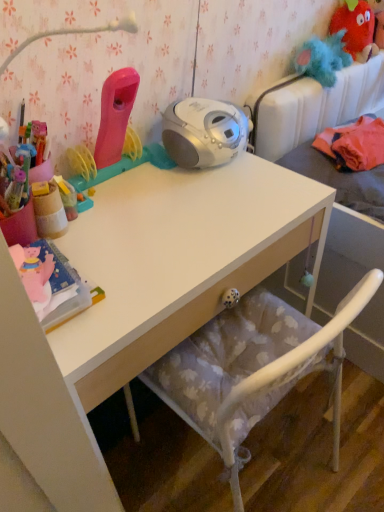
At what (x,y) coordinates should I click in order to perform the action: click on fluffy fabric bed at upper right. Please return your answer as a coordinate pair (x, y). This screenshot has height=512, width=384. Looking at the image, I should click on (318, 106).

Where is `wooden pencil case at left`? The image size is (384, 512). wooden pencil case at left is located at coordinates (50, 214).

Identify the location of fluffy fabric bed at upper right. The width and height of the screenshot is (384, 512). (318, 106).

From the picture: Is wooden pencil case at left turned away from white matte desk at center?

No.

Is wooden pencil case at left in front of or behind white matte desk at center in the image?

In the image, wooden pencil case at left appears behind white matte desk at center.

Does wooden pencil case at left appear on the right side of white matte desk at center?

No.

In the scene shown: Between wooden pencil case at left and white matte desk at center, which one has less height?

With less height is wooden pencil case at left.

Consider the image. Is wooden pencil case at left thinner than fuzzy red monster at upper right?

Correct, the width of wooden pencil case at left is less than that of fuzzy red monster at upper right.

Does wooden pencil case at left appear on the right side of fuzzy red monster at upper right?

In fact, wooden pencil case at left is to the left of fuzzy red monster at upper right.

Which object is closer to the camera taking this photo, wooden pencil case at left or fuzzy red monster at upper right?

wooden pencil case at left is in front.

Considering the relative sizes of wooden pencil case at left and fluffy fabric bed at upper right in the image provided, is wooden pencil case at left wider than fluffy fabric bed at upper right?

In fact, wooden pencil case at left might be narrower than fluffy fabric bed at upper right.

Does wooden pencil case at left turn towards fluffy fabric bed at upper right?

No, wooden pencil case at left is not oriented towards fluffy fabric bed at upper right.

Is wooden pencil case at left smaller than fluffy fabric bed at upper right?

Indeed, wooden pencil case at left has a smaller size compared to fluffy fabric bed at upper right.

From a real-world perspective, relative to fluffy fabric bed at upper right, is wooden pencil case at left vertically above or below?

wooden pencil case at left is situated higher than fluffy fabric bed at upper right in the real world.

From a real-world perspective, is white matte desk at center beneath fuzzy red monster at upper right?

Correct, in the physical world, white matte desk at center is lower than fuzzy red monster at upper right.

Does white matte desk at center have a smaller size compared to fuzzy red monster at upper right?

No.

From the image's perspective, is white matte desk at center over fuzzy red monster at upper right?

Incorrect, from the image's perspective, white matte desk at center is lower than fuzzy red monster at upper right.

Considering the relative sizes of white matte desk at center and fuzzy red monster at upper right in the image provided, is white matte desk at center thinner than fuzzy red monster at upper right?

No.

From a real-world perspective, is fuzzy red monster at upper right positioned over white matte desk at center based on gravity?

Yes, from a real-world perspective, fuzzy red monster at upper right is above white matte desk at center.

Is fuzzy red monster at upper right next to white matte desk at center?

There is a gap between fuzzy red monster at upper right and white matte desk at center.

Is fuzzy red monster at upper right located outside white matte desk at center?

That's correct, fuzzy red monster at upper right is outside of white matte desk at center.

You are a GUI agent. You are given a task and a screenshot of the screen. Output one action in this format:
    pyautogui.click(x=<x>, y=<y>)
    Task: Click on the toy above the white matte desk at center (from the image's perspective)
    
    Given the screenshot: What is the action you would take?
    pyautogui.click(x=356, y=30)

In terms of size, does fuzzy red monster at upper right appear bigger or smaller than wooden pencil case at left?

Clearly, fuzzy red monster at upper right is larger in size than wooden pencil case at left.

Which object is closer to the camera, fuzzy red monster at upper right or wooden pencil case at left?

wooden pencil case at left.

You are a GUI agent. You are given a task and a screenshot of the screen. Output one action in this format:
    pyautogui.click(x=<x>, y=<y>)
    Task: Click on the stationery lying in front of the fuzzy red monster at upper right
    The image size is (384, 512).
    Given the screenshot: What is the action you would take?
    pyautogui.click(x=50, y=214)

Considering the sizes of fuzzy red monster at upper right and wooden pencil case at left in the image, is fuzzy red monster at upper right wider or thinner than wooden pencil case at left?

Clearly, fuzzy red monster at upper right has more width compared to wooden pencil case at left.

Is point (362, 27) positioned in front of point (342, 75)?

That is False.

From the image's perspective, is fuzzy red monster at upper right located beneath fluffy fabric bed at upper right?

Actually, fuzzy red monster at upper right appears above fluffy fabric bed at upper right in the image.

Is fluffy fabric bed at upper right a part of fuzzy red monster at upper right?

No.

Locate an element on the screen. bed located on the right of fuzzy red monster at upper right is located at coordinates (318, 106).

In order to click on desk in front of the wooden pencil case at left in this screenshot , I will do `click(136, 308)`.

Image resolution: width=384 pixels, height=512 pixels. In order to click on toy that is above the wooden pencil case at left (from a real-world perspective) in this screenshot , I will do `click(356, 30)`.

Considering their positions, is fuzzy red monster at upper right positioned further to white matte desk at center than wooden pencil case at left?

fuzzy red monster at upper right.

Estimate the real-world distances between objects in this image. Which object is closer to white matte desk at center, fluffy fabric bed at upper right or fuzzy red monster at upper right?

fluffy fabric bed at upper right is positioned closer to the anchor white matte desk at center.

Estimate the real-world distances between objects in this image. Which object is further from fuzzy red monster at upper right, fluffy fabric bed at upper right or white matte desk at center?

white matte desk at center lies further to fuzzy red monster at upper right than the other object.

Based on the photo, from the image, which object appears to be farther from white matte desk at center, fuzzy red monster at upper right or fluffy fabric bed at upper right?

Based on the image, fuzzy red monster at upper right appears to be further to white matte desk at center.

Estimate the real-world distances between objects in this image. Which object is further from fuzzy red monster at upper right, wooden pencil case at left or white matte desk at center?

wooden pencil case at left.

When comparing their distances from fuzzy red monster at upper right, does fluffy fabric bed at upper right or wooden pencil case at left seem closer?

fluffy fabric bed at upper right lies closer to fuzzy red monster at upper right than the other object.

Based on their spatial positions, is white matte desk at center or fuzzy red monster at upper right further from wooden pencil case at left?

fuzzy red monster at upper right.

Considering their positions, is wooden pencil case at left positioned further to fuzzy red monster at upper right than fluffy fabric bed at upper right?

Among the two, wooden pencil case at left is located further to fuzzy red monster at upper right.

Where is `desk between wooden pencil case at left and fluffy fabric bed at upper right from left to right`? This screenshot has width=384, height=512. desk between wooden pencil case at left and fluffy fabric bed at upper right from left to right is located at coordinates (136, 308).

Locate an element on the screen. The image size is (384, 512). toy situated between wooden pencil case at left and fluffy fabric bed at upper right from left to right is located at coordinates (356, 30).

Identify the location of bed that lies between fuzzy red monster at upper right and white matte desk at center from top to bottom. This screenshot has width=384, height=512. (318, 106).

Locate an element on the screen. Image resolution: width=384 pixels, height=512 pixels. stationery between fuzzy red monster at upper right and white matte desk at center in the vertical direction is located at coordinates (50, 214).